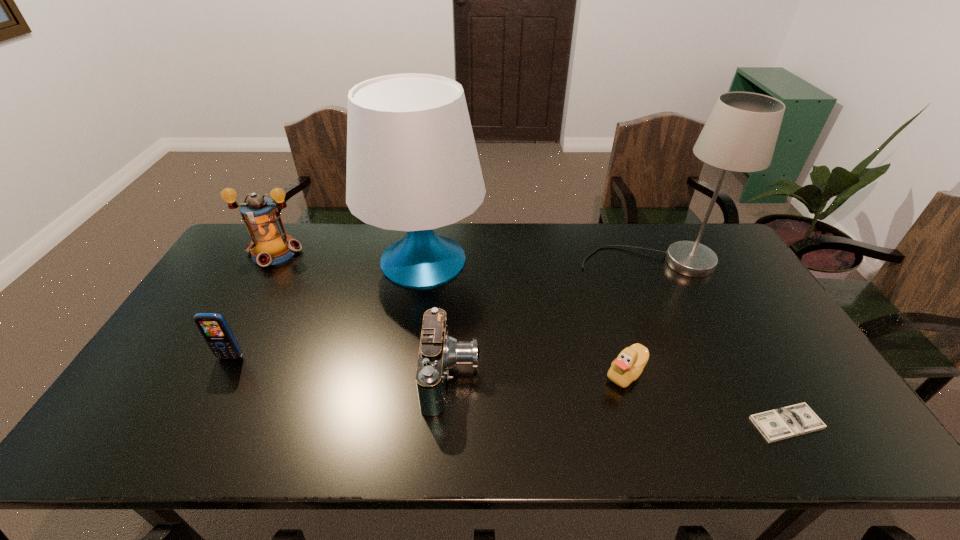
I want to click on free point that satisfies the following two spatial constraints: 1. on the front-facing side of the dollar; 2. on the left side of the lantern, so click(x=177, y=423).

You are a GUI agent. You are given a task and a screenshot of the screen. Output one action in this format:
    pyautogui.click(x=<x>, y=<y>)
    Task: Click on the vacant point that satisfies the following two spatial constraints: 1. on the front-facing side of the right table lamp; 2. on the right side of the left table lamp
    The image size is (960, 540).
    Given the screenshot: What is the action you would take?
    pyautogui.click(x=423, y=262)